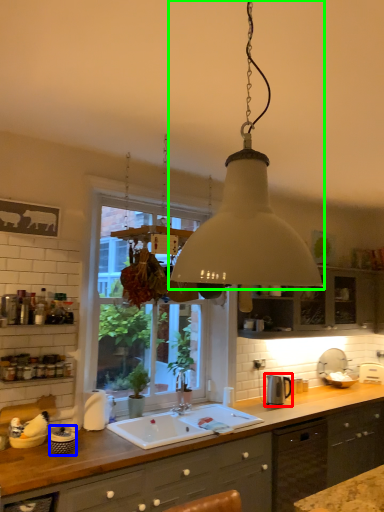
Question: Which is nearer to the appliance (highlighted by a red box)? appliance (highlighted by a blue box) or lamp (highlighted by a green box).

Choices:
 (A) appliance
 (B) lamp

Answer: (A)